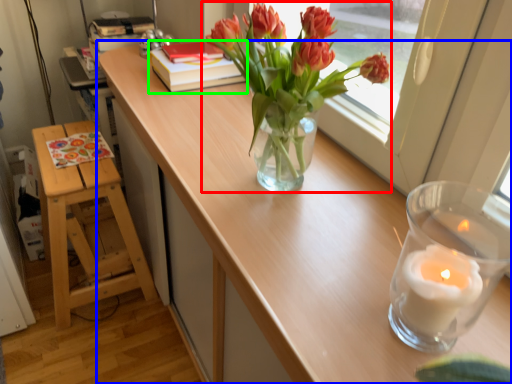
Question: Which object is the closest to the houseplant (highlighted by a red box)? Choose among these: table (highlighted by a blue box) or book (highlighted by a green box).

Choices:
 (A) table
 (B) book

Answer: (A)